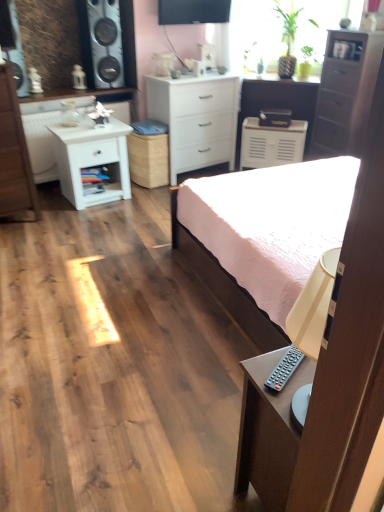
The height and width of the screenshot is (512, 384). Find the location of `vacant area located to the right-hand side of white wood chest of drawers at left, acting as the first chest of drawers starting from the left`. vacant area located to the right-hand side of white wood chest of drawers at left, acting as the first chest of drawers starting from the left is located at coordinates (54, 216).